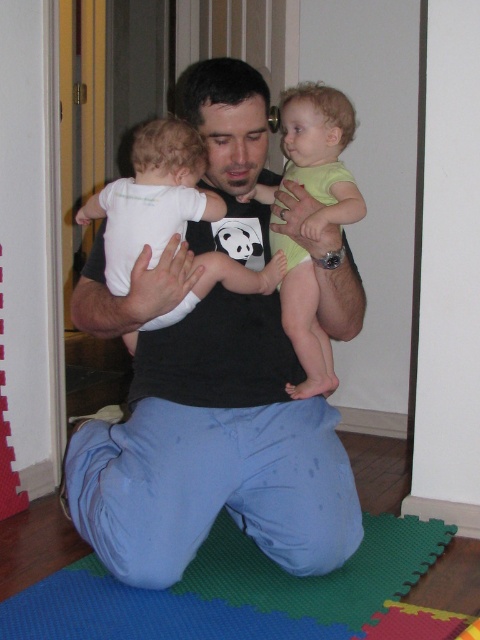
Which is above, black cotton shirt at center or light green fabric toddler at center?

light green fabric toddler at center is above.

Between black cotton shirt at center and light green fabric toddler at center, which one has more height?

black cotton shirt at center

Image resolution: width=480 pixels, height=640 pixels. Identify the location of black cotton shirt at center. (215, 451).

Does light green fabric toddler at center have a smaller size compared to white matte onesie at left?

Yes, light green fabric toddler at center is smaller than white matte onesie at left.

At what (x,y) coordinates should I click in order to perform the action: click on light green fabric toddler at center. Please return your answer as a coordinate pair (x, y). Looking at the image, I should click on (321, 152).

Can you confirm if black cotton shirt at center is thinner than green foam mat at lower center?

Indeed, black cotton shirt at center has a lesser width compared to green foam mat at lower center.

Is point (137, 476) positioned after point (63, 614)?

That is True.

Identify the location of black cotton shirt at center. (215, 451).